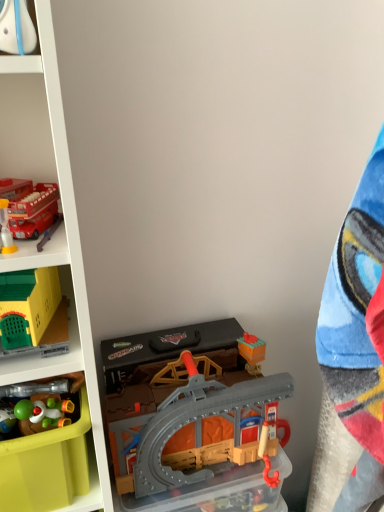
Question: Is matte green plastic storage box at lower left, the second storage box from the right, to the left of plastic/grey track at lower center, positioned as the 5th toy in left-to-right order, from the viewer's perspective?

Choices:
 (A) yes
 (B) no

Answer: (A)

Question: From a real-world perspective, is matte green plastic storage box at lower left, the first storage box when ordered from left to right, under plastic/grey track at lower center, positioned as the 5th toy in left-to-right order?

Choices:
 (A) no
 (B) yes

Answer: (A)

Question: From the image's perspective, is matte green plastic storage box at lower left, the second storage box from the right, located above plastic/grey track at lower center, positioned as the 5th toy in left-to-right order?

Choices:
 (A) yes
 (B) no

Answer: (A)

Question: Is matte green plastic storage box at lower left, the second storage box from the right, placed right next to plastic/grey track at lower center, which is the first toy in right-to-left order?

Choices:
 (A) yes
 (B) no

Answer: (B)

Question: Could you tell me if matte green plastic storage box at lower left, the second storage box from the right, is turned towards plastic/grey track at lower center, which is the first toy in right-to-left order?

Choices:
 (A) no
 (B) yes

Answer: (A)

Question: In terms of width, does yellow plastic playhouse at left, which is the fifth toy from right to left, look wider or thinner when compared to translucent plastic storage box at center, which is the first storage box in right-to-left order?

Choices:
 (A) thin
 (B) wide

Answer: (B)

Question: Is yellow plastic playhouse at left, which is the fifth toy from right to left, situated inside translucent plastic storage box at center, which is the first storage box in right-to-left order, or outside?

Choices:
 (A) outside
 (B) inside

Answer: (A)

Question: Is point (16, 322) positioned closer to the camera than point (256, 493)?

Choices:
 (A) farther
 (B) closer

Answer: (B)

Question: From a real-world perspective, is yellow plastic playhouse at left, arranged as the first toy when viewed from the left, physically located above or below translucent plastic storage box at center, which is the first storage box in right-to-left order?

Choices:
 (A) above
 (B) below

Answer: (A)

Question: Is plastic/grey track at lower center, positioned as the 5th toy in left-to-right order, in front of or behind shiny plastic toy at lower left, the third toy viewed from the left, in the image?

Choices:
 (A) front
 (B) behind

Answer: (B)

Question: Is plastic/grey track at lower center, positioned as the 5th toy in left-to-right order, spatially inside shiny plastic toy at lower left, the 3th toy from the right, or outside of it?

Choices:
 (A) inside
 (B) outside

Answer: (B)

Question: From a real-world perspective, is plastic/grey track at lower center, positioned as the 5th toy in left-to-right order, above or below shiny plastic toy at lower left, the third toy viewed from the left?

Choices:
 (A) below
 (B) above

Answer: (A)

Question: Considering the positions of plastic/grey track at lower center, which is the first toy in right-to-left order, and shiny plastic toy at lower left, the third toy viewed from the left, in the image, is plastic/grey track at lower center, which is the first toy in right-to-left order, taller or shorter than shiny plastic toy at lower left, the third toy viewed from the left,?

Choices:
 (A) short
 (B) tall

Answer: (B)

Question: Is translucent plastic storage box at center, which is the first storage box in right-to-left order, wider or thinner than matte red bus at upper left, which ranks as the fourth toy in left-to-right order?

Choices:
 (A) thin
 (B) wide

Answer: (B)

Question: Based on their sizes in the image, would you say translucent plastic storage box at center, which is the 2th storage box from left to right, is bigger or smaller than matte red bus at upper left, marked as the second toy in a right-to-left arrangement?

Choices:
 (A) big
 (B) small

Answer: (A)